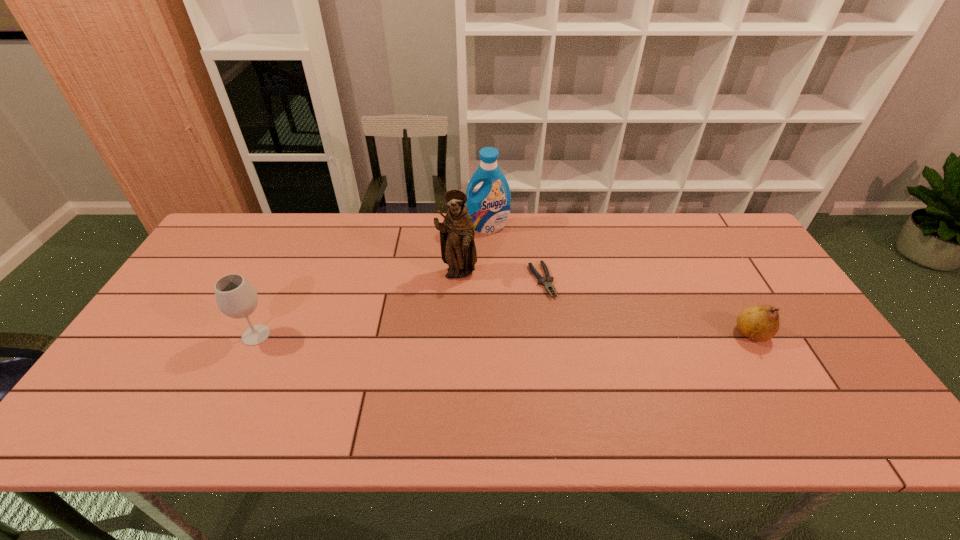
You are a GUI agent. You are given a task and a screenshot of the screen. Output one action in this format:
    pyautogui.click(x=<x>, y=<y>)
    Task: Click on the free space that is in between the figurine and the pear
    
    Given the screenshot: What is the action you would take?
    pyautogui.click(x=605, y=304)

This screenshot has height=540, width=960. What are the coordinates of `vacant point located between the second shortest object and the wineglass` in the screenshot? It's located at (504, 334).

The height and width of the screenshot is (540, 960). I want to click on vacant space that's between the leftmost object and the pear, so click(504, 334).

This screenshot has width=960, height=540. In order to click on free area in between the leftmost object and the rightmost object in this screenshot , I will do `click(504, 334)`.

The image size is (960, 540). Identify the location of vacant space in between the pliers and the figurine. (499, 278).

Choose which object is the third nearest neighbor to the detergent. Please provide its 2D coordinates. Your answer should be formatted as a tuple, i.e. [(x, y)], where the tuple contains the x and y coordinates of a point satisfying the conditions above.

[(235, 296)]

Locate an element on the screen. object that is the closest one to the leftmost object is located at coordinates (458, 250).

Locate an element on the screen. This screenshot has height=540, width=960. free location that satisfies the following two spatial constraints: 1. on the front side of the fourth tallest object; 2. on the right side of the figurine is located at coordinates (454, 334).

At what (x,y) coordinates should I click in order to perform the action: click on blank area in the image that satisfies the following two spatial constraints: 1. on the back side of the pliers; 2. on the right side of the wineglass. Please return your answer as a coordinate pair (x, y). This screenshot has height=540, width=960. Looking at the image, I should click on (282, 281).